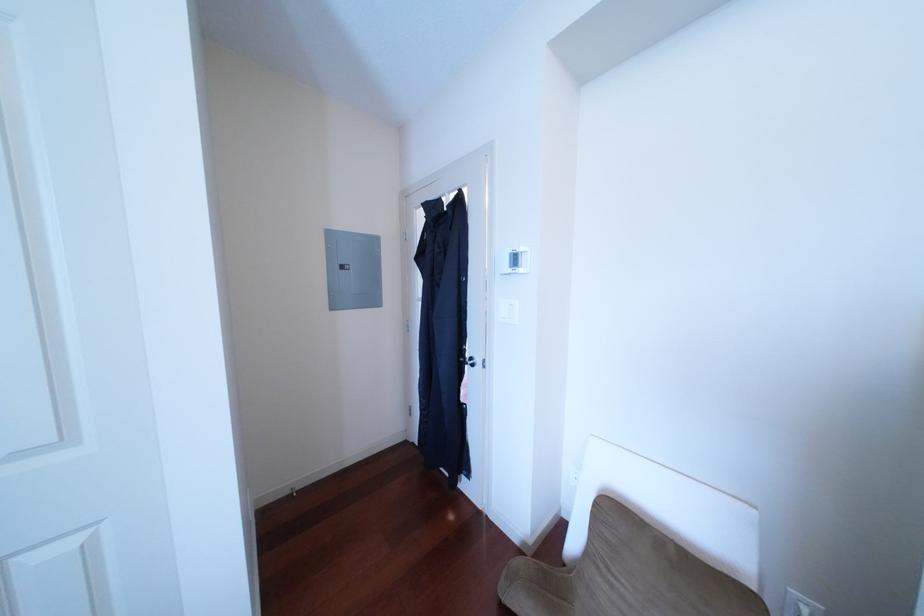
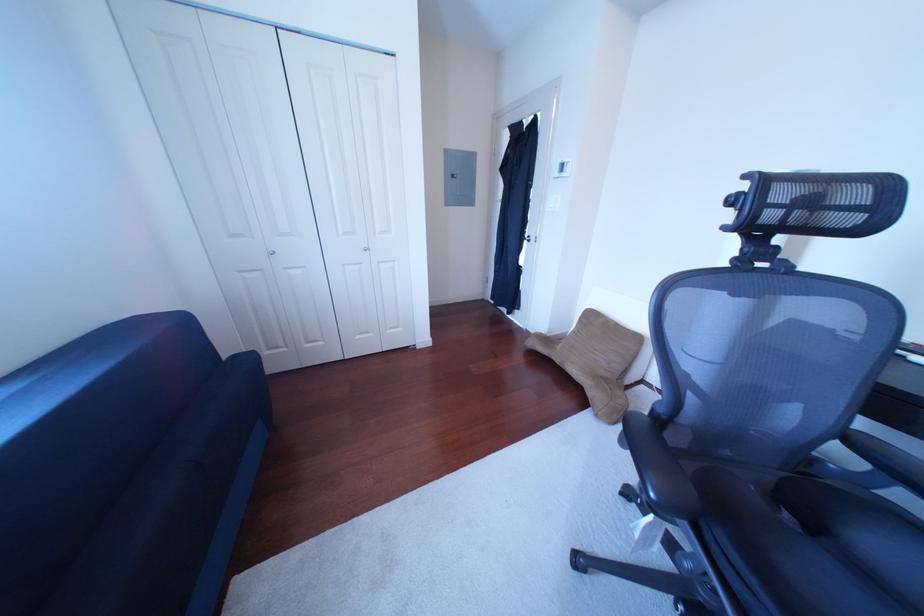
Question: Which direction would the cameraman need to move to produce the second image? Reply with the corresponding letter.

Choices:
 (A) Left
 (B) Right
 (C) Forward
 (D) Backward

Answer: (D)